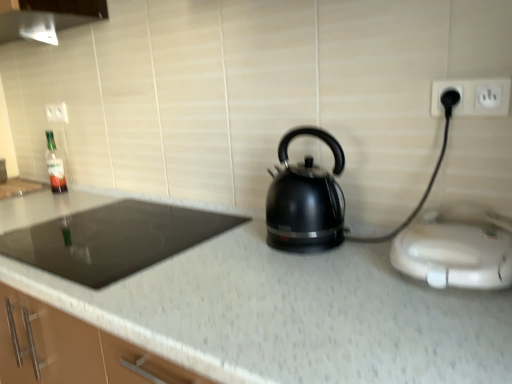
This screenshot has height=384, width=512. What are the coordinates of `free point to the right of translucent glass bottle at left` in the screenshot? It's located at pyautogui.click(x=80, y=193).